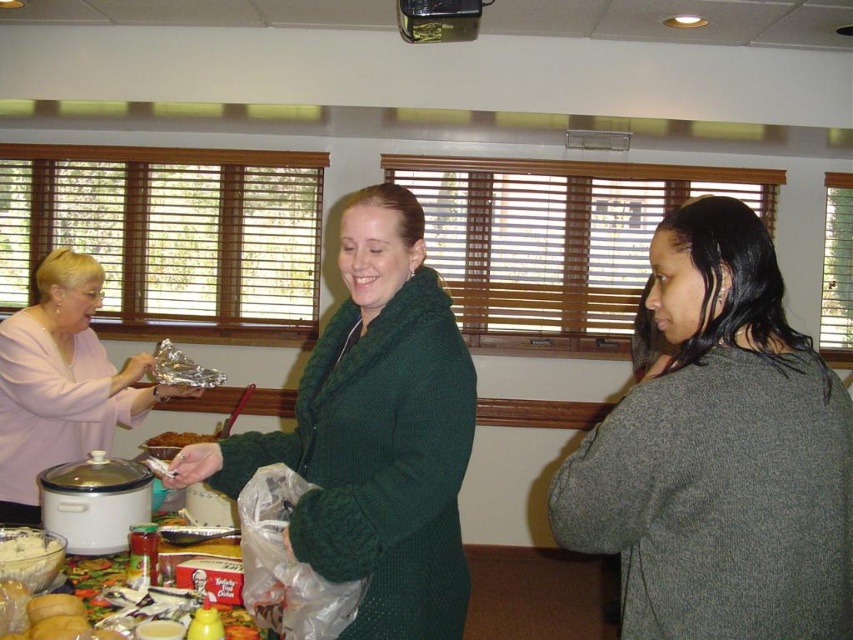
Question: Does gray wool sweater at right appear under plastic tableware at lower left?

Choices:
 (A) no
 (B) yes

Answer: (A)

Question: Which of the following is the farthest from the observer?

Choices:
 (A) (305, 369)
 (B) (15, 552)
 (C) (167, 515)

Answer: (C)

Question: Can you confirm if matte pink sweater at left is bigger than plastic tableware at lower left?

Choices:
 (A) no
 (B) yes

Answer: (B)

Question: Which point appears farthest from the camera in this image?

Choices:
 (A) (154, 436)
 (B) (32, 308)

Answer: (A)

Question: Which object is the farthest from the gray wool sweater at right?

Choices:
 (A) plastic tableware at lower left
 (B) brown matte food at center
 (C) matte pink sweater at left
 (D) green knitted sweater at center

Answer: (C)

Question: Does matte pink sweater at left have a smaller size compared to white creamy dip at lower left?

Choices:
 (A) yes
 (B) no

Answer: (B)